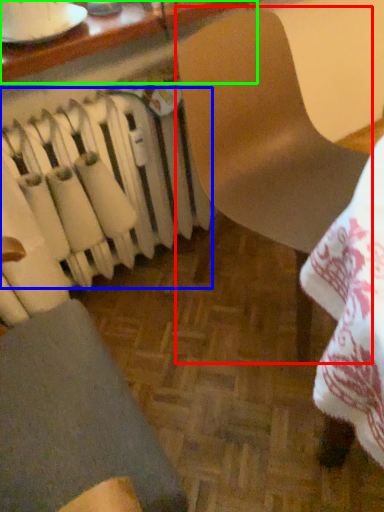
Question: Based on their relative distances, which object is nearer to chair (highlighted by a red box)? Choose from radiator (highlighted by a blue box) and table (highlighted by a green box).

Choices:
 (A) radiator
 (B) table

Answer: (A)